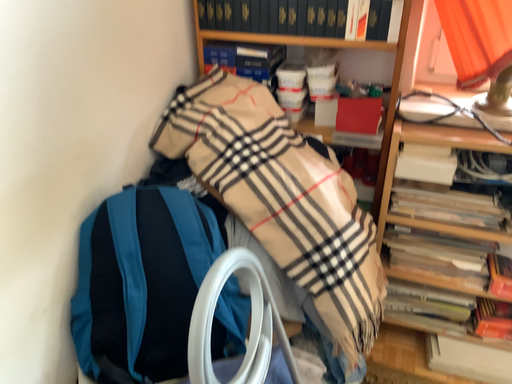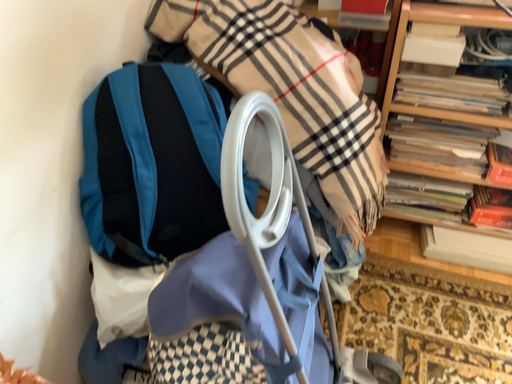
Question: How did the camera likely rotate when shooting the video?

Choices:
 (A) rotated upward
 (B) rotated downward

Answer: (B)